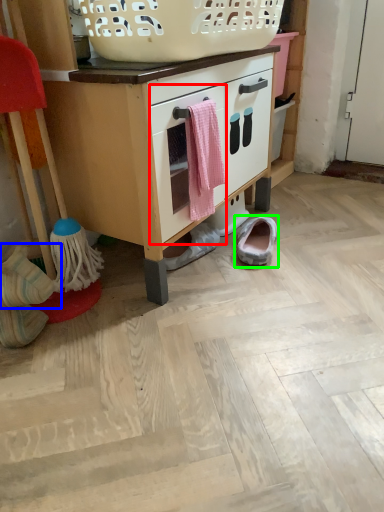
Question: Which is nearer to the drawer (highlighted by a red box)? footwear (highlighted by a blue box) or footwear (highlighted by a green box).

Choices:
 (A) footwear
 (B) footwear

Answer: (B)